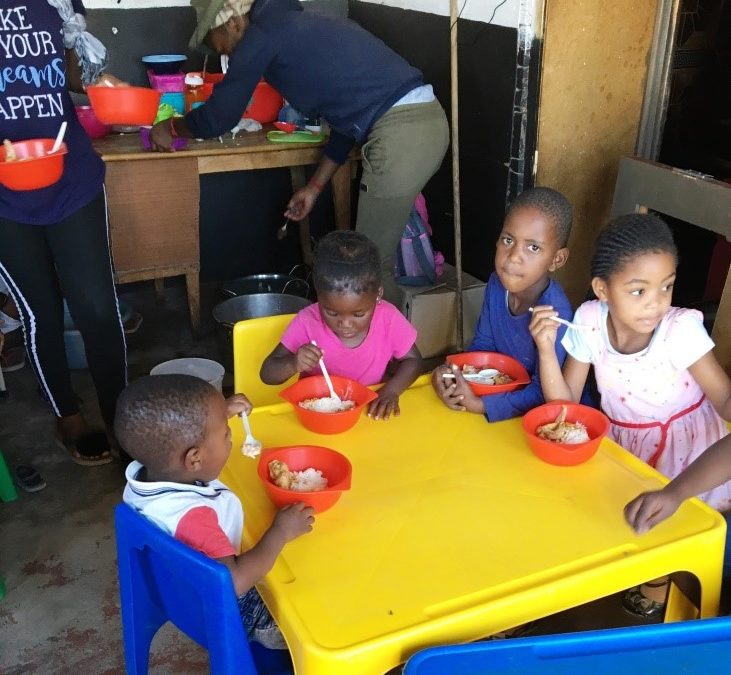
Where is `red bowl`? The height and width of the screenshot is (675, 731). red bowl is located at coordinates (501, 374).